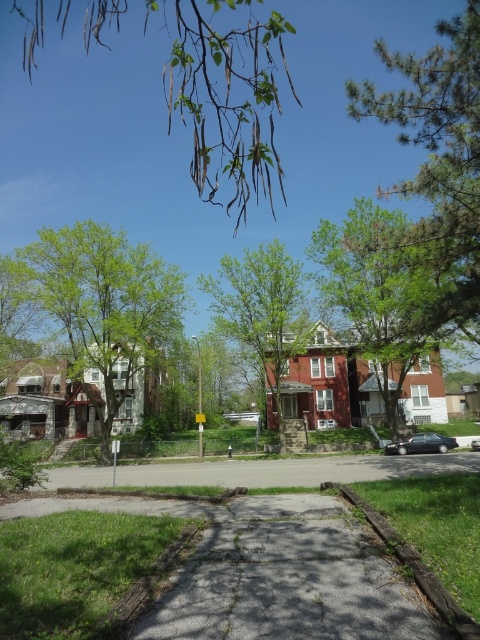
Who is positioned more to the left, green pine tree at upper right or brown wooden curb at lower right?

Positioned to the left is brown wooden curb at lower right.

Which is behind, point (445, 109) or point (370, 515)?

Positioned behind is point (445, 109).

Between point (479, 256) and point (420, 564), which one is positioned in front?

Point (420, 564) is more forward.

At what (x,y) coordinates should I click in order to perform the action: click on green pine tree at upper right. Please return your answer as a coordinate pair (x, y). Looking at the image, I should click on (440, 157).

Can you confirm if green leafy tree at left is positioned to the left of shiny black sedan at lower right?

Yes, green leafy tree at left is to the left of shiny black sedan at lower right.

Is green leafy tree at left wider than shiny black sedan at lower right?

Correct, the width of green leafy tree at left exceeds that of shiny black sedan at lower right.

Locate an element on the screen. Image resolution: width=480 pixels, height=640 pixels. green leafy tree at left is located at coordinates (108, 305).

Based on the photo, does green leafy branches at upper center have a smaller size compared to brown wooden curb at lower right?

No.

Does green leafy branches at upper center appear over brown wooden curb at lower right?

Correct, green leafy branches at upper center is located above brown wooden curb at lower right.

Who is more distant from viewer, (217, 1) or (387, 531)?

Positioned behind is point (387, 531).

Locate an element on the screen. The width and height of the screenshot is (480, 640). green leafy branches at upper center is located at coordinates (203, 83).